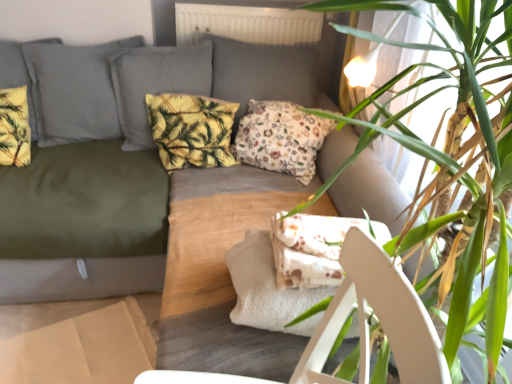
At what (x,y) coordinates should I click in order to perform the action: click on free point above white cardboard box at lower left (from a real-world perspective). Please return your answer as a coordinate pair (x, y). Image resolution: width=512 pixels, height=384 pixels. Looking at the image, I should click on (64, 346).